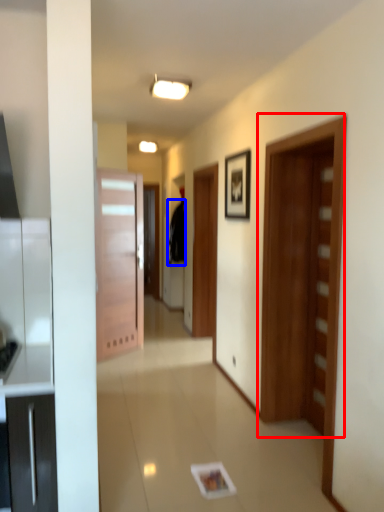
Question: Among these objects, which one is farthest to the camera, door (highlighted by a red box) or robe (highlighted by a blue box)?

Choices:
 (A) door
 (B) robe

Answer: (B)